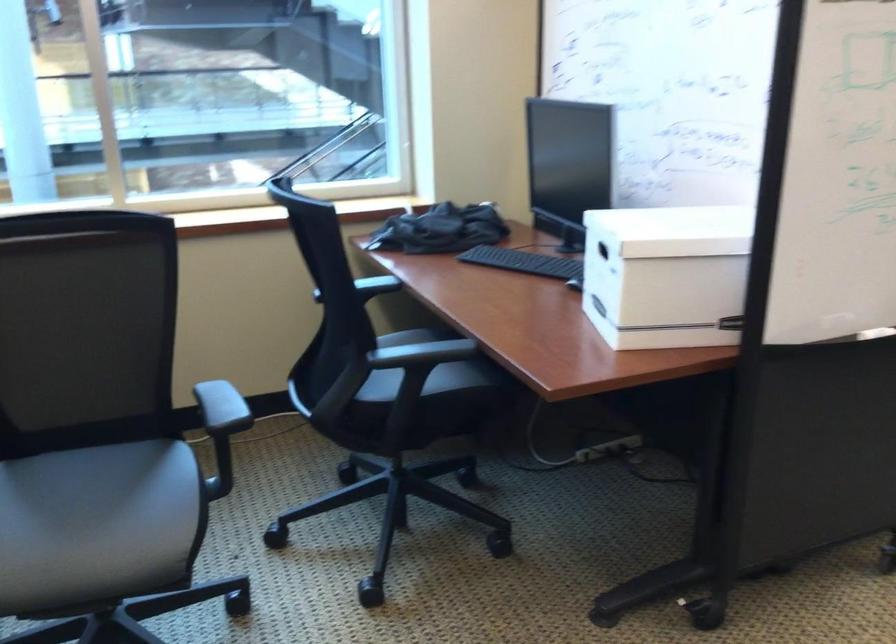
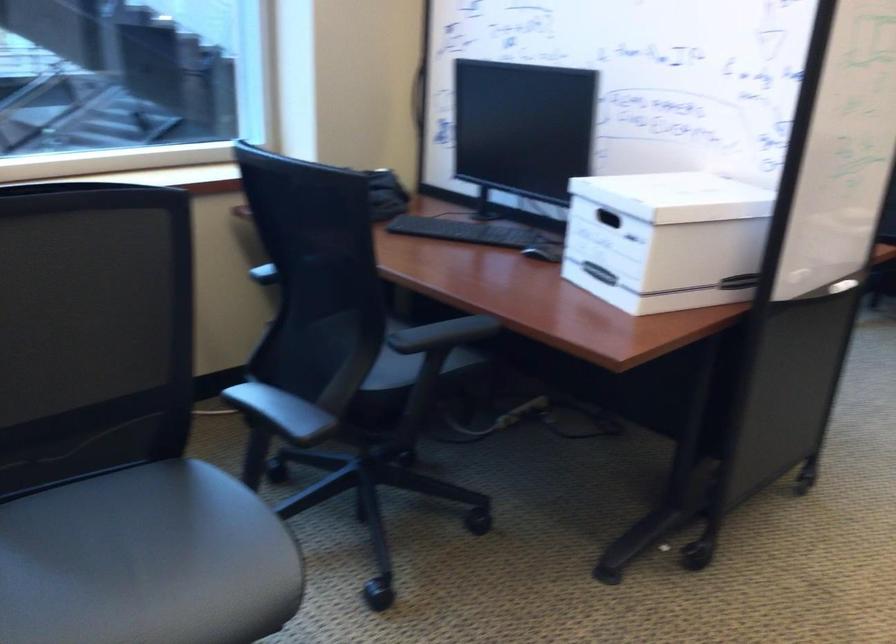
The point at (412, 384) is marked in the first image. Where is the corresponding point in the second image?

(410, 368)